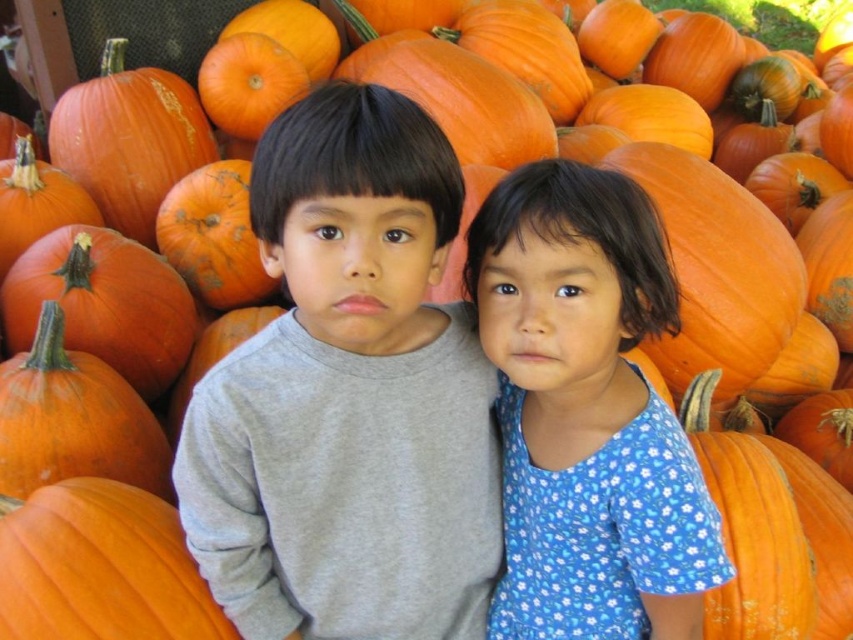
Question: In this image, where is gray cotton shirt at center located relative to blue floral dress at center?

Choices:
 (A) right
 (B) left

Answer: (B)

Question: Which object is farther from the camera taking this photo?

Choices:
 (A) blue floral dress at center
 (B) gray cotton shirt at center

Answer: (A)

Question: Is gray cotton shirt at center thinner than blue floral dress at center?

Choices:
 (A) no
 (B) yes

Answer: (A)

Question: Which point is farther to the camera?

Choices:
 (A) blue floral dress at center
 (B) gray cotton shirt at center

Answer: (A)

Question: Is gray cotton shirt at center positioned in front of blue floral dress at center?

Choices:
 (A) no
 (B) yes

Answer: (B)